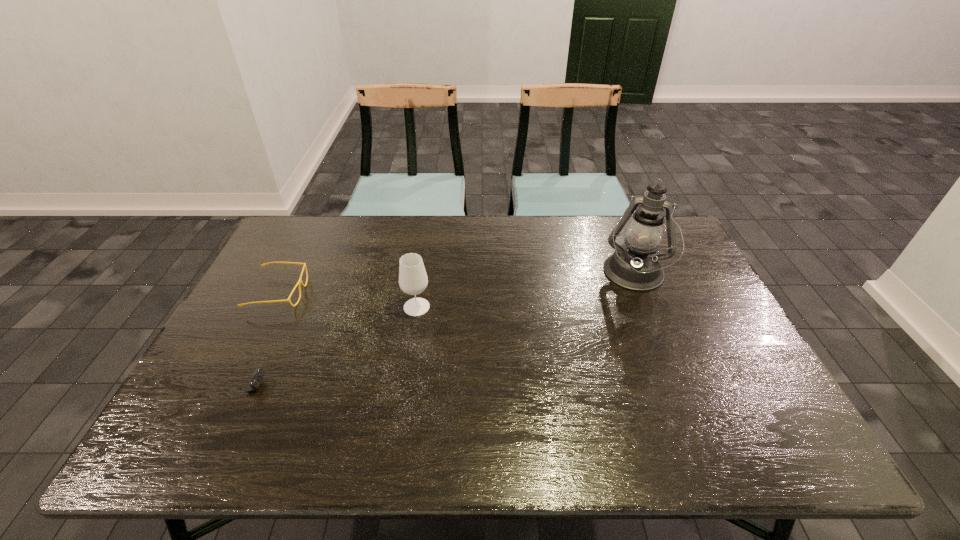
You are a GUI agent. You are given a task and a screenshot of the screen. Output one action in this format:
    pyautogui.click(x=<x>, y=<y>)
    Task: Click on the vacant space located 0.200m on the front-facing side of the shortest object
    This screenshot has width=960, height=540.
    Given the screenshot: What is the action you would take?
    pyautogui.click(x=347, y=387)

Find the location of `object located at the far edge`. object located at the far edge is located at coordinates (636, 266).

Identify the location of spectacles at the left edge. The width and height of the screenshot is (960, 540). (299, 282).

Identify the location of webcam positioned at the left edge. (256, 379).

Image resolution: width=960 pixels, height=540 pixels. Identify the location of object present at the right edge. (636, 266).

Locate an element on the screen. This screenshot has height=540, width=960. object that is positioned at the far right corner is located at coordinates (636, 266).

You are a GUI agent. You are given a task and a screenshot of the screen. Output one action in this format:
    pyautogui.click(x=<x>, y=<y>)
    Task: Click on the blank space at the far edge of the desktop
    This screenshot has width=960, height=540.
    Given the screenshot: What is the action you would take?
    pyautogui.click(x=357, y=229)

In the image, there is a desktop. Where is `free space at the near edge`? Image resolution: width=960 pixels, height=540 pixels. free space at the near edge is located at coordinates (489, 458).

Locate an element on the screen. This screenshot has height=540, width=960. blank area at the left edge is located at coordinates (286, 316).

You are a GUI agent. You are given a task and a screenshot of the screen. Output one action in this format:
    pyautogui.click(x=<x>, y=<y>)
    Task: Click on the vacant space at the near right corner of the desktop
    The width and height of the screenshot is (960, 540).
    Given the screenshot: What is the action you would take?
    pyautogui.click(x=783, y=431)